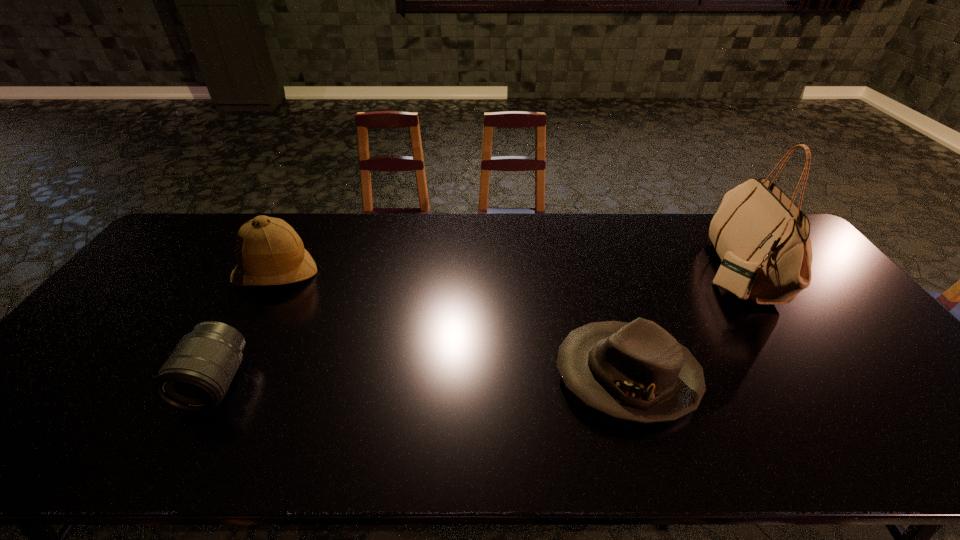
This screenshot has width=960, height=540. Identify the location of handbag. (762, 237).

Where is `the tallest object`? The width and height of the screenshot is (960, 540). the tallest object is located at coordinates (762, 237).

You are a GUI agent. You are given a task and a screenshot of the screen. Output one action in this format:
    pyautogui.click(x=<x>, y=<y>)
    Task: Click on the third shortest object
    
    Given the screenshot: What is the action you would take?
    pyautogui.click(x=268, y=250)

Find the location of a particular element. the left hat is located at coordinates (268, 250).

Locate an element on the screen. This screenshot has width=960, height=540. telephoto lens is located at coordinates (196, 377).

You are a GUI agent. You are given a task and a screenshot of the screen. Output one action in this format:
    pyautogui.click(x=<x>, y=<y>)
    Task: Click on the nearer hat
    
    Given the screenshot: What is the action you would take?
    pyautogui.click(x=637, y=371)

This screenshot has width=960, height=540. In order to click on the right hat in this screenshot , I will do `click(637, 371)`.

Where is `vacant area situated on the side of the handbag with the attached pouch`? Image resolution: width=960 pixels, height=540 pixels. vacant area situated on the side of the handbag with the attached pouch is located at coordinates (631, 272).

In order to click on vacant point located 0.100m on the side of the handbag with the attached pouch in this screenshot , I will do `click(673, 272)`.

Find the location of a particular element. Image resolution: width=960 pixels, height=540 pixels. vacant space located on the side of the handbag with the attached pouch is located at coordinates (602, 272).